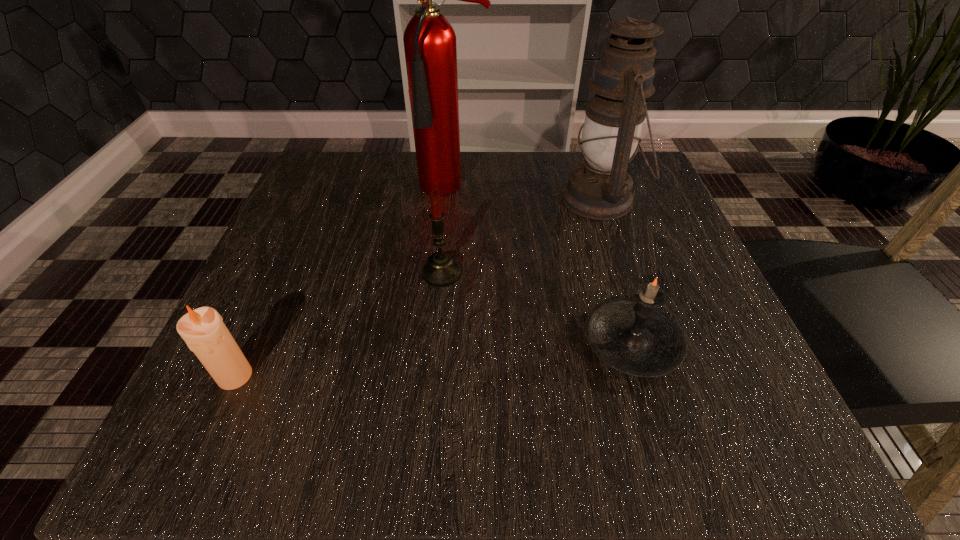
You are a GUI agent. You are given a task and a screenshot of the screen. Output one action in this format:
    pyautogui.click(x=<x>, y=<y>)
    Task: Click on the free space located on the left of the rightmost candle
    Image resolution: width=960 pixels, height=540 pixels.
    Given the screenshot: What is the action you would take?
    pyautogui.click(x=474, y=343)

I want to click on fire extinguisher located in the far edge section of the desktop, so click(429, 40).

You are a GUI agent. You are given a task and a screenshot of the screen. Output one action in this format:
    pyautogui.click(x=<x>, y=<y>)
    Task: Click on the oil lamp present at the far edge
    
    Given the screenshot: What is the action you would take?
    pyautogui.click(x=600, y=188)

The height and width of the screenshot is (540, 960). I want to click on object that is at the left edge, so click(203, 330).

Locate an element on the screen. This screenshot has height=540, width=960. oil lamp that is positioned at the right edge is located at coordinates [x=600, y=188].

What are the coordinates of `candle located at the right edge` in the screenshot? It's located at (635, 336).

I want to click on object located in the far right corner section of the desktop, so click(600, 188).

Image resolution: width=960 pixels, height=540 pixels. In the image, there is a desktop. In order to click on vacant region at the far edge in this screenshot , I will do `click(403, 194)`.

In the image, there is a desktop. What are the coordinates of `vacant space at the left edge` in the screenshot? It's located at (333, 339).

Identify the location of free space at the right edge. pos(724,308).